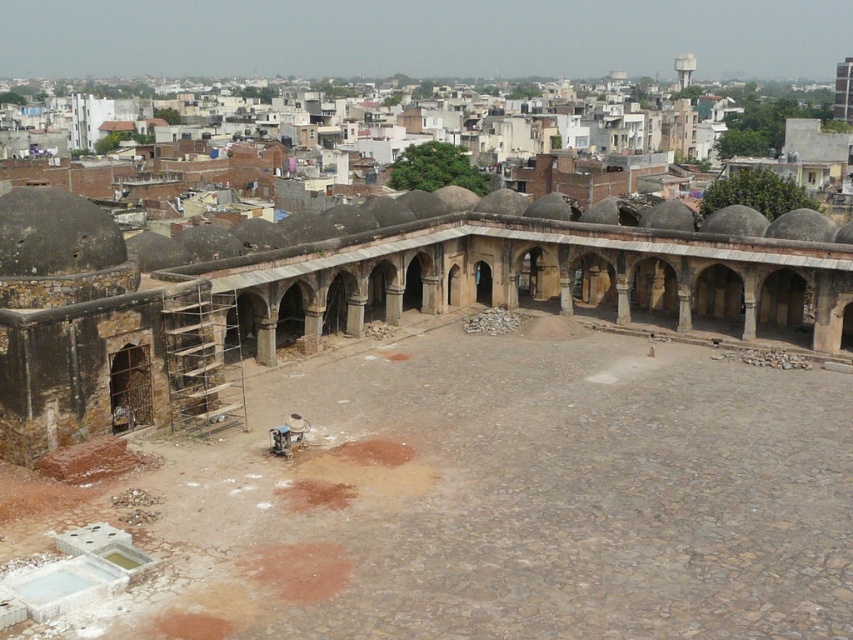
You are standing in the courtyard and want to walk from the point marked as point (630, 390) to the point marked as point (572, 244). Which direction should you move?

You should move backward because point (630, 390) is in front of point (572, 244), so moving backward will take you towards the latter point.

You are standing in the courtyard and want to walk from the brown stone courtyard at center to the stone paved courtyard at center. Which direction should you move?

You should move to your right because the stone paved courtyard at center is located to the right of the brown stone courtyard at center.